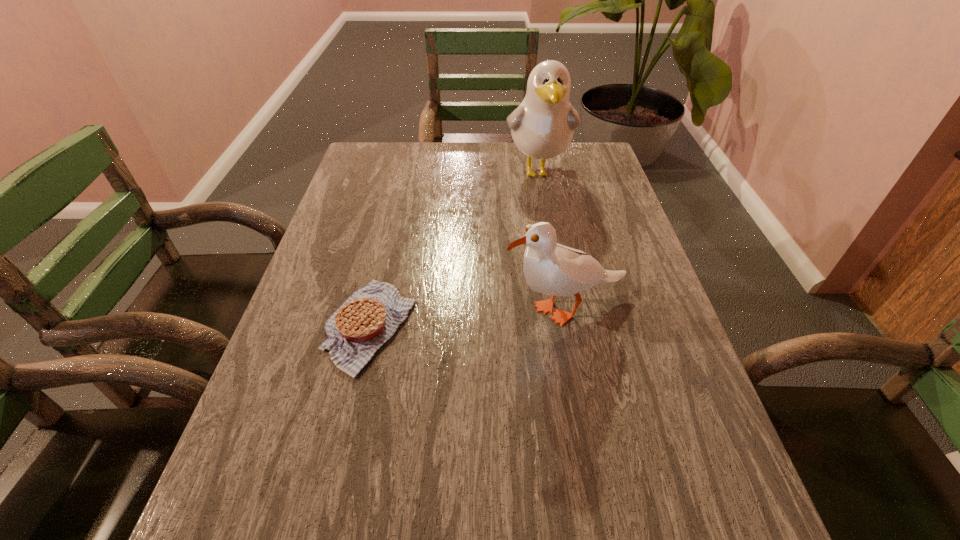
Identify the location of empty space between the pie and the second tallest object. This screenshot has width=960, height=540. (468, 318).

Locate an element on the screen. This screenshot has height=540, width=960. vacant point located between the nearer gull and the pie is located at coordinates (468, 318).

This screenshot has height=540, width=960. In order to click on vacant space in between the pie and the farther gull in this screenshot , I will do `click(454, 249)`.

Locate an element on the screen. free area in between the shortest object and the farther gull is located at coordinates (454, 249).

Locate an element on the screen. The width and height of the screenshot is (960, 540). unoccupied area between the nearer gull and the pie is located at coordinates (468, 318).

Find the location of `vacant region between the pie and the farther gull`. vacant region between the pie and the farther gull is located at coordinates (454, 249).

Locate an element on the screen. The image size is (960, 540). free spot between the second shortest object and the shortest object is located at coordinates (468, 318).

This screenshot has width=960, height=540. What are the coordinates of `the second closest object to the leftmost object` in the screenshot? It's located at (542, 126).

Point out which object is positioned as the nearest to the leftmost object. Please provide its 2D coordinates. Your answer should be formatted as a tuple, i.e. [(x, y)], where the tuple contains the x and y coordinates of a point satisfying the conditions above.

[(550, 268)]